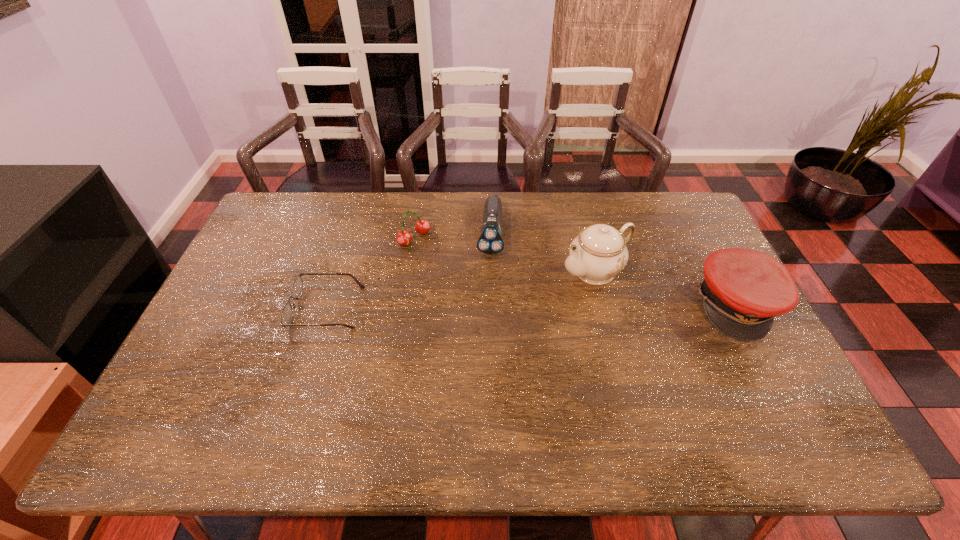
The height and width of the screenshot is (540, 960). I want to click on free space located 0.120m on the front-facing side of the leftmost object, so click(252, 308).

Locate an element on the screen. This screenshot has height=540, width=960. vacant space situated 0.100m on the front of the rightmost object with an emblem is located at coordinates (774, 374).

The image size is (960, 540). Identify the location of vacant space located 0.290m with stems pointing upwards on the cherry. (485, 293).

Where is `free space located with stems pointing upwards on the cherry`? free space located with stems pointing upwards on the cherry is located at coordinates (504, 308).

The image size is (960, 540). Identify the location of vacant area situated 0.150m with stems pointing upwards on the cherry. (454, 269).

Where is `vacant space located on the head of the electric shaver`? Image resolution: width=960 pixels, height=540 pixels. vacant space located on the head of the electric shaver is located at coordinates (484, 329).

This screenshot has height=540, width=960. I want to click on vacant region located 0.240m on the head of the electric shaver, so click(x=485, y=318).

Where is `free spot located 0.250m on the head of the electric shaver`? free spot located 0.250m on the head of the electric shaver is located at coordinates (x=485, y=321).

Find the location of a particular element. free region located at the spout of the chinaware is located at coordinates (522, 304).

You are a GUI agent. You are given a task and a screenshot of the screen. Output one action in this format:
    pyautogui.click(x=<x>, y=<y>)
    Task: Click on the free space located 0.250m at the spout of the chinaware
    This screenshot has height=540, width=960.
    Given the screenshot: What is the action you would take?
    pyautogui.click(x=500, y=316)